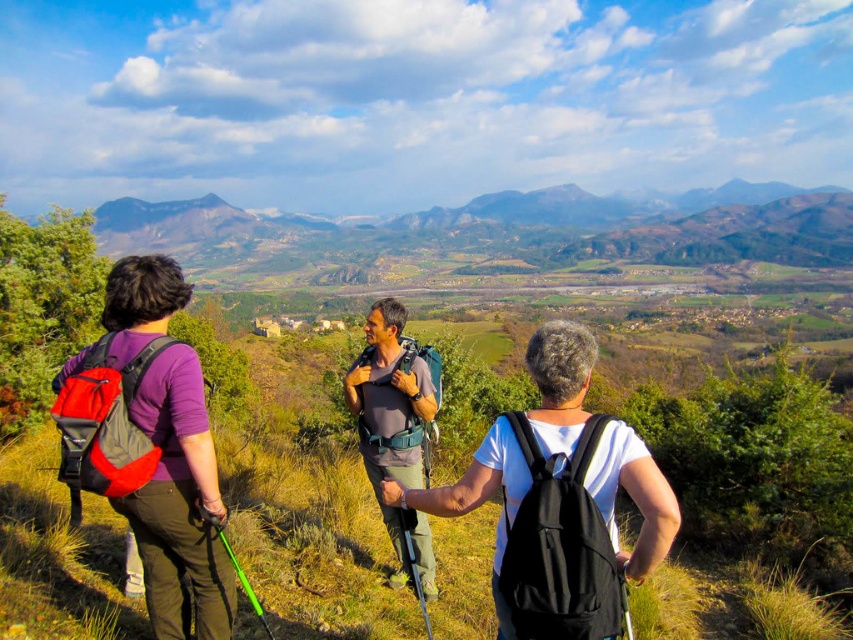
You are a hiker standing at the base of the hill. You see the matte black backpack at center and the third hiker ahead. How far apart are they?

The matte black backpack at center and the third hiker are 6.82 meters apart.

You are a photographer trying to capture the matte black backpack at center and the matte gray shirt at center in the same frame. Based on their sizes in the image, which object would appear larger in your photo?

The matte black backpack at center appears larger than the matte gray shirt at center in the image because it is taller.